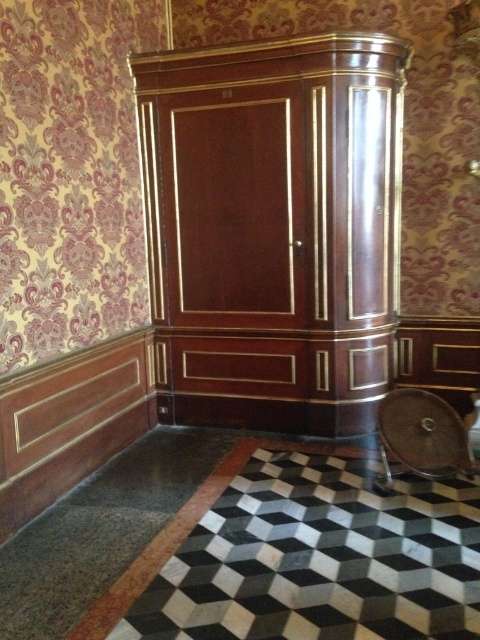
Does point (256, 426) come closer to viewer compared to point (391, 440)?

No.

Looking at this image, can you confirm if mahogany wood armoire at center is smaller than brown leather chair at lower right?

Actually, mahogany wood armoire at center might be larger than brown leather chair at lower right.

The width and height of the screenshot is (480, 640). I want to click on mahogany wood armoire at center, so click(x=274, y=228).